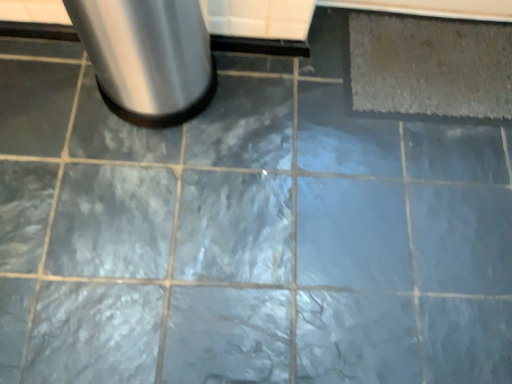
Question: Is gray textured mat at upper right thinner than brushed metal trash can at upper left?

Choices:
 (A) yes
 (B) no

Answer: (B)

Question: From the image's perspective, is gray textured mat at upper right on brushed metal trash can at upper left?

Choices:
 (A) yes
 (B) no

Answer: (A)

Question: Does gray textured mat at upper right have a greater width compared to brushed metal trash can at upper left?

Choices:
 (A) yes
 (B) no

Answer: (A)

Question: Is gray textured mat at upper right positioned before brushed metal trash can at upper left?

Choices:
 (A) no
 (B) yes

Answer: (A)

Question: From a real-world perspective, is gray textured mat at upper right positioned over brushed metal trash can at upper left based on gravity?

Choices:
 (A) no
 (B) yes

Answer: (A)

Question: Considering the relative sizes of gray textured mat at upper right and brushed metal trash can at upper left in the image provided, is gray textured mat at upper right smaller than brushed metal trash can at upper left?

Choices:
 (A) no
 (B) yes

Answer: (B)

Question: Considering the relative sizes of brushed metal trash can at upper left and gray textured mat at upper right in the image provided, is brushed metal trash can at upper left wider than gray textured mat at upper right?

Choices:
 (A) no
 (B) yes

Answer: (A)

Question: Is brushed metal trash can at upper left taller than gray textured mat at upper right?

Choices:
 (A) yes
 (B) no

Answer: (A)

Question: From the image's perspective, would you say brushed metal trash can at upper left is positioned over gray textured mat at upper right?

Choices:
 (A) no
 (B) yes

Answer: (A)

Question: Could you tell me if brushed metal trash can at upper left is turned towards gray textured mat at upper right?

Choices:
 (A) no
 (B) yes

Answer: (A)

Question: From a real-world perspective, is brushed metal trash can at upper left over gray textured mat at upper right?

Choices:
 (A) no
 (B) yes

Answer: (B)

Question: Does brushed metal trash can at upper left have a smaller size compared to gray textured mat at upper right?

Choices:
 (A) yes
 (B) no

Answer: (B)

Question: Relative to brushed metal trash can at upper left, is gray textured mat at upper right in front or behind?

Choices:
 (A) behind
 (B) front

Answer: (A)